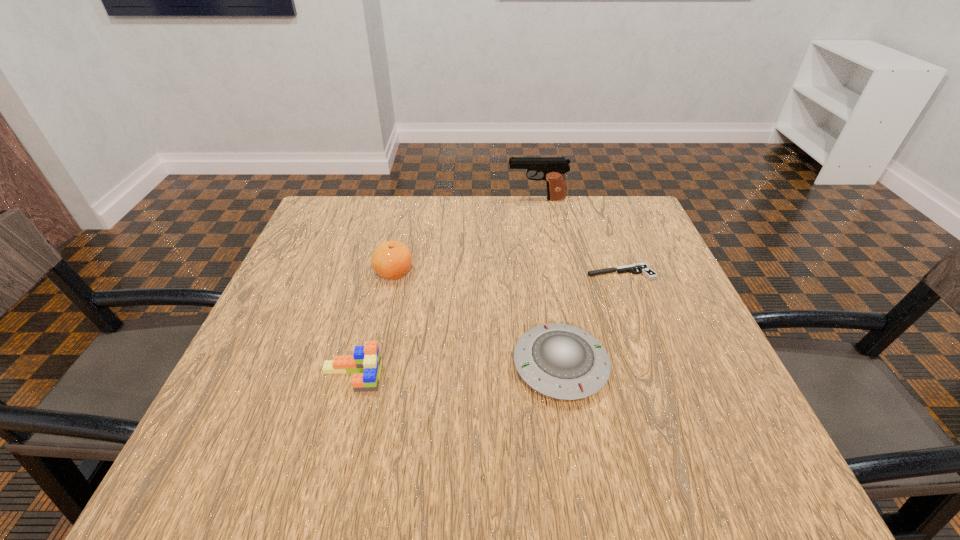
Locate an element on the screen. vacant space located 0.160m on the front of the clementine is located at coordinates (379, 339).

I want to click on free space located on the back of the Lego, so click(385, 249).

The height and width of the screenshot is (540, 960). In order to click on blank space located 0.050m on the left of the saucer in this screenshot , I will do `click(487, 366)`.

At what (x,y) coordinates should I click in order to perform the action: click on free space located 0.060m on the front-facing side of the shorter pistol. Please return your answer as a coordinate pair (x, y). The image size is (960, 540). Looking at the image, I should click on (561, 273).

Find the location of a particular element. free space located 0.260m on the front-facing side of the shorter pistol is located at coordinates (475, 273).

Where is `blank space located 0.310m on the front-facing side of the shorter pistol`? The width and height of the screenshot is (960, 540). blank space located 0.310m on the front-facing side of the shorter pistol is located at coordinates (453, 273).

Locate an element on the screen. The height and width of the screenshot is (540, 960). object located in the far edge section of the desktop is located at coordinates (553, 168).

This screenshot has height=540, width=960. In order to click on object situated at the right edge in this screenshot , I will do `click(641, 268)`.

At what (x,y) coordinates should I click in order to perform the action: click on vacant space at the far edge of the desktop. Please return your answer as a coordinate pair (x, y). Image resolution: width=960 pixels, height=540 pixels. Looking at the image, I should click on (491, 213).

Where is `vacant space at the near edge`? The width and height of the screenshot is (960, 540). vacant space at the near edge is located at coordinates (532, 428).